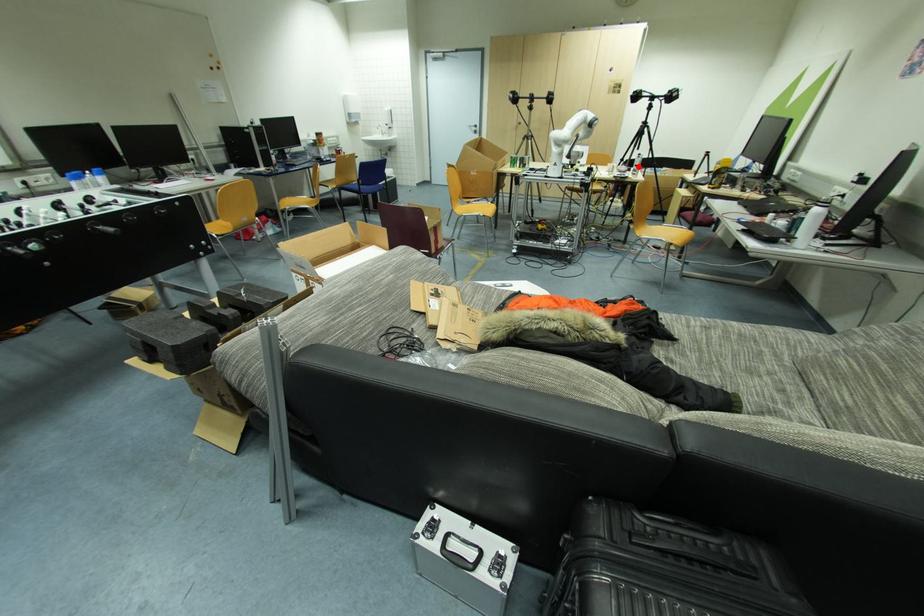
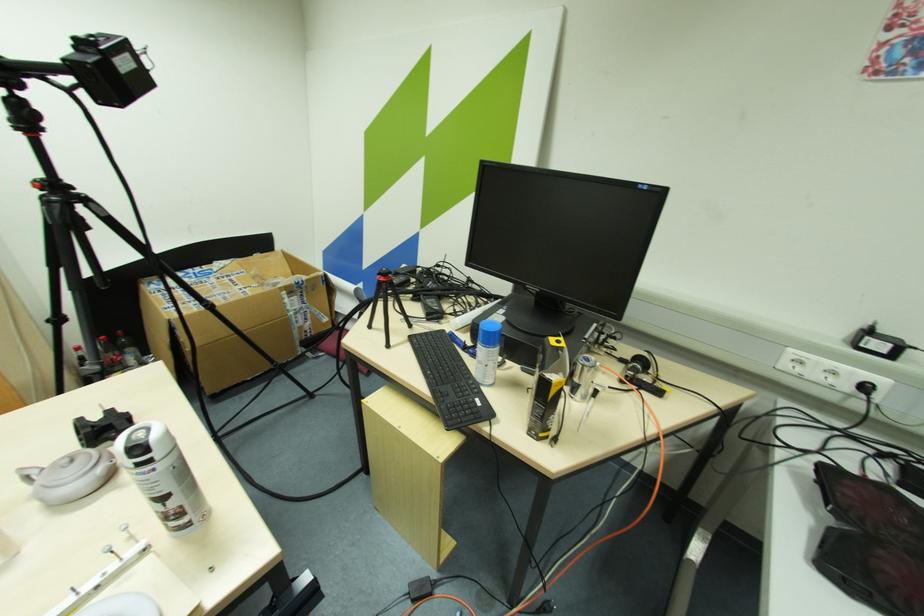
The point at the highlighted location is marked in the first image. Where is the corresponding point in the second image?

(164, 500)